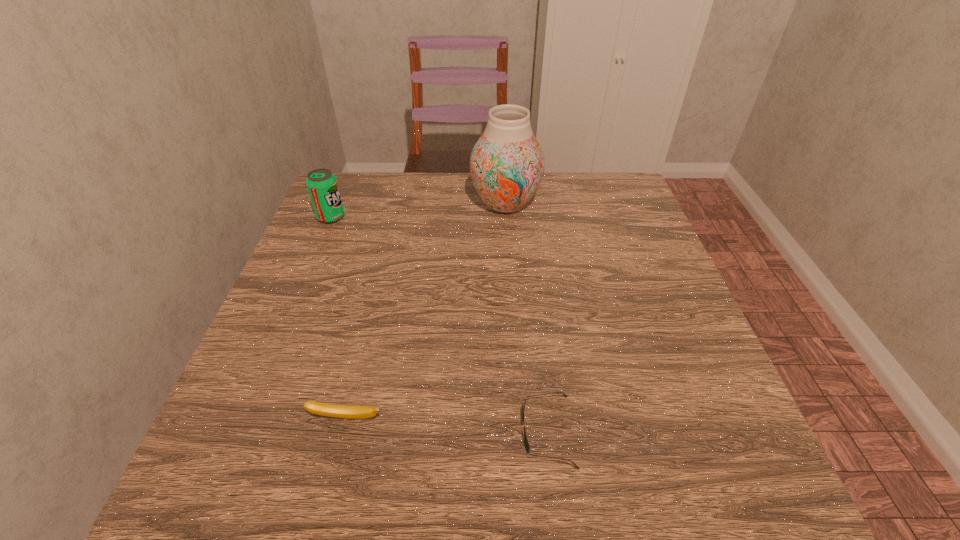
The image size is (960, 540). What are the coordinates of `free spot between the shortest object and the third object from right to left` in the screenshot? It's located at (447, 424).

The width and height of the screenshot is (960, 540). What are the coordinates of `vacant space that's between the vase and the second shortest object` in the screenshot? It's located at (426, 311).

Find the location of a particular element. This screenshot has width=960, height=540. vacant space in between the third tallest object and the tallest object is located at coordinates (426, 311).

The width and height of the screenshot is (960, 540). I want to click on empty location between the tallest object and the pop soda, so click(x=419, y=211).

Find the location of `unoccupied area between the leftmost object and the third tallest object`. unoccupied area between the leftmost object and the third tallest object is located at coordinates (339, 318).

Find the location of a particular element. object identified as the closest to the tallest object is located at coordinates (322, 186).

Locate which object ranks second in proximity to the second tallest object. Please provide its 2D coordinates. Your answer should be formatted as a tuple, i.e. [(x, y)], where the tuple contains the x and y coordinates of a point satisfying the conditions above.

[(331, 410)]